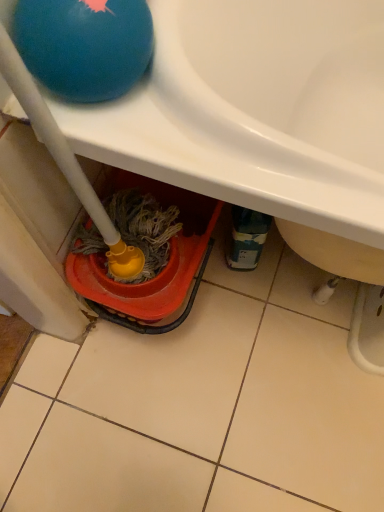
Question: Considering the relative sizes of white glossy sink at upper center and blue rubber ball at upper left in the image provided, is white glossy sink at upper center thinner than blue rubber ball at upper left?

Choices:
 (A) no
 (B) yes

Answer: (A)

Question: Is white glossy sink at upper center in front of blue rubber ball at upper left?

Choices:
 (A) yes
 (B) no

Answer: (A)

Question: Considering the relative sizes of white glossy sink at upper center and blue rubber ball at upper left in the image provided, is white glossy sink at upper center bigger than blue rubber ball at upper left?

Choices:
 (A) no
 (B) yes

Answer: (B)

Question: Is white glossy sink at upper center wider than blue rubber ball at upper left?

Choices:
 (A) yes
 (B) no

Answer: (A)

Question: From a real-world perspective, is white glossy sink at upper center physically above blue rubber ball at upper left?

Choices:
 (A) yes
 (B) no

Answer: (B)

Question: Can you confirm if white glossy sink at upper center is taller than blue rubber ball at upper left?

Choices:
 (A) no
 (B) yes

Answer: (B)

Question: Is blue rubber ball at upper left far away from white glossy sink at upper center?

Choices:
 (A) yes
 (B) no

Answer: (B)

Question: From the image's perspective, would you say blue rubber ball at upper left is positioned over white glossy sink at upper center?

Choices:
 (A) no
 (B) yes

Answer: (A)

Question: From the image's perspective, is blue rubber ball at upper left located beneath white glossy sink at upper center?

Choices:
 (A) yes
 (B) no

Answer: (A)

Question: Is blue rubber ball at upper left oriented towards white glossy sink at upper center?

Choices:
 (A) no
 (B) yes

Answer: (A)

Question: Considering the relative sizes of blue rubber ball at upper left and white glossy sink at upper center in the image provided, is blue rubber ball at upper left thinner than white glossy sink at upper center?

Choices:
 (A) yes
 (B) no

Answer: (A)

Question: Is blue rubber ball at upper left facing away from white glossy sink at upper center?

Choices:
 (A) no
 (B) yes

Answer: (A)

Question: Would you say blue rubber ball at upper left is to the left or to the right of white glossy sink at upper center in the picture?

Choices:
 (A) right
 (B) left

Answer: (B)